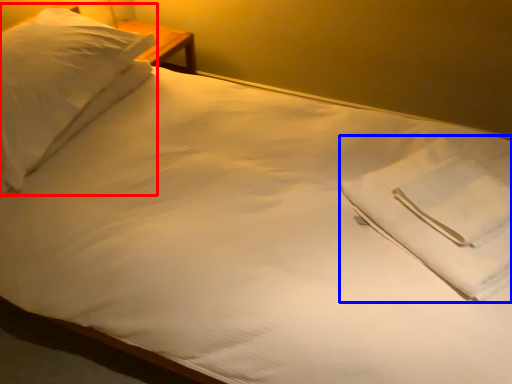
Question: Which of the following is the farthest to the observer, pillow (highlighted by a red box) or cloth (highlighted by a blue box)?

Choices:
 (A) pillow
 (B) cloth

Answer: (A)